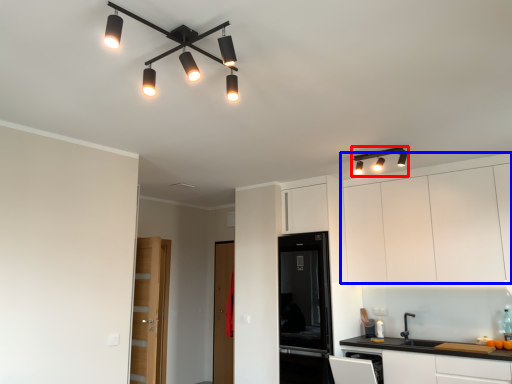
Question: Among these objects, which one is farthest to the camera, light fixture (highlighted by a red box) or cabinetry (highlighted by a blue box)?

Choices:
 (A) light fixture
 (B) cabinetry

Answer: (A)